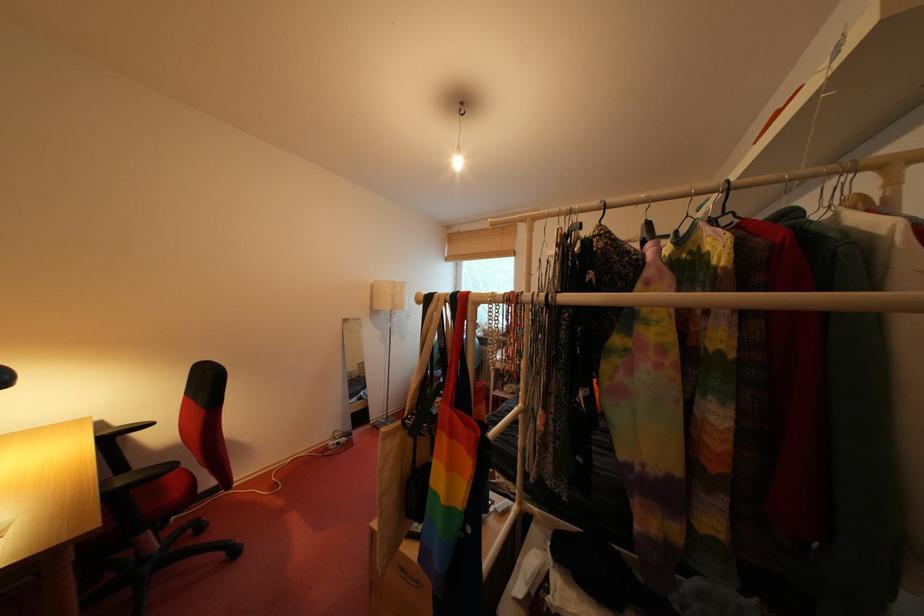
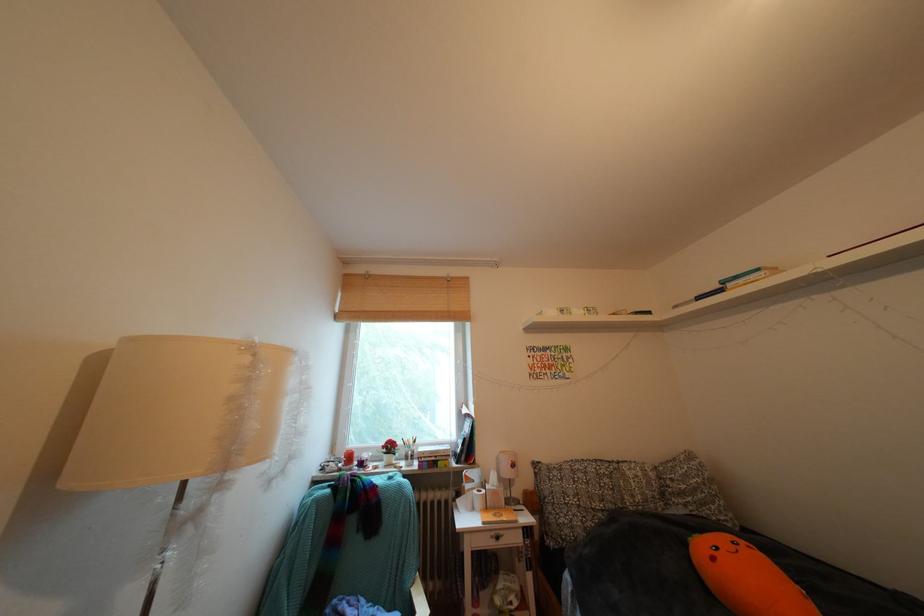
Find the pixel in the second image that matches pixel 404 288 in the first image.

(259, 353)